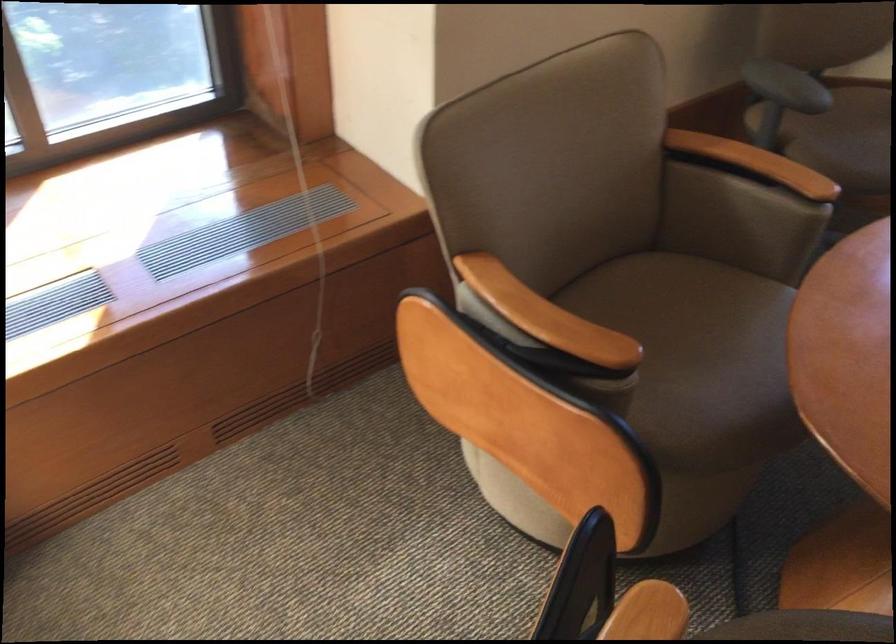
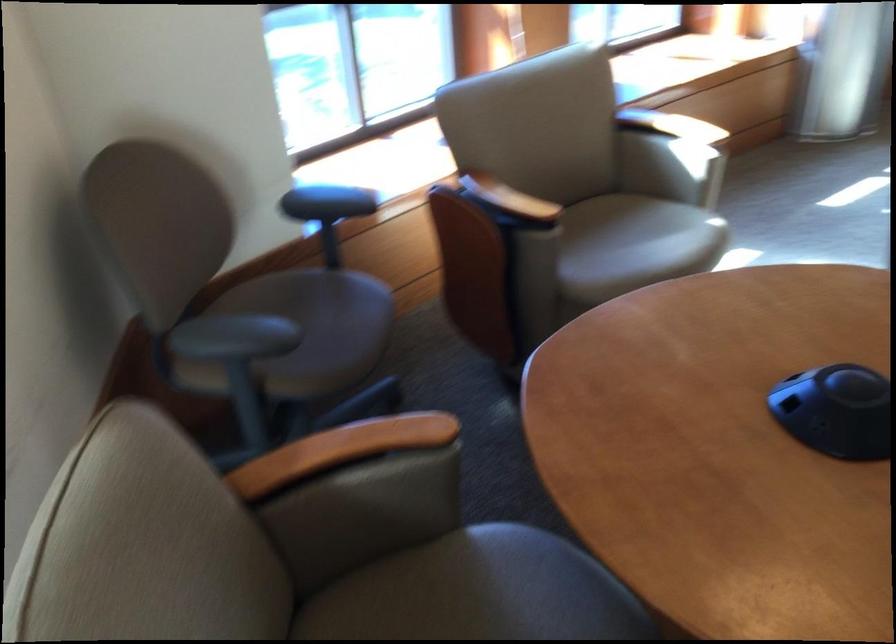
The point at (x=787, y=73) is marked in the first image. Where is the corresponding point in the second image?

(234, 337)